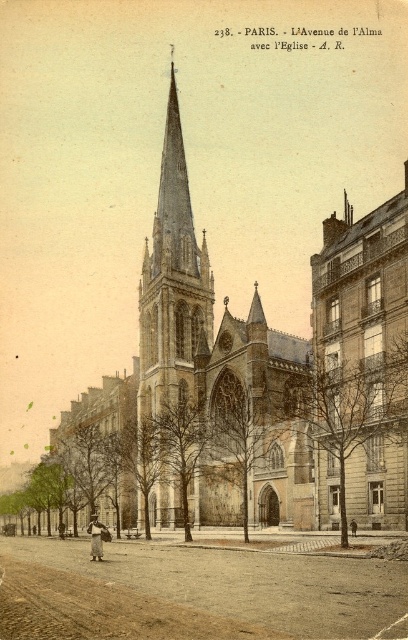
Can you confirm if brown stone church at center is wider than stone gothic tower at center?

Yes.

In the scene shown: Does brown stone church at center appear over stone gothic tower at center?

Incorrect, brown stone church at center is not positioned above stone gothic tower at center.

Does point (397, 397) lie behind point (188, 385)?

That is False.

At what (x,y) coordinates should I click in order to perform the action: click on brown stone church at center. Please return your answer as a coordinate pair (x, y). The width and height of the screenshot is (408, 640). Looking at the image, I should click on (283, 365).